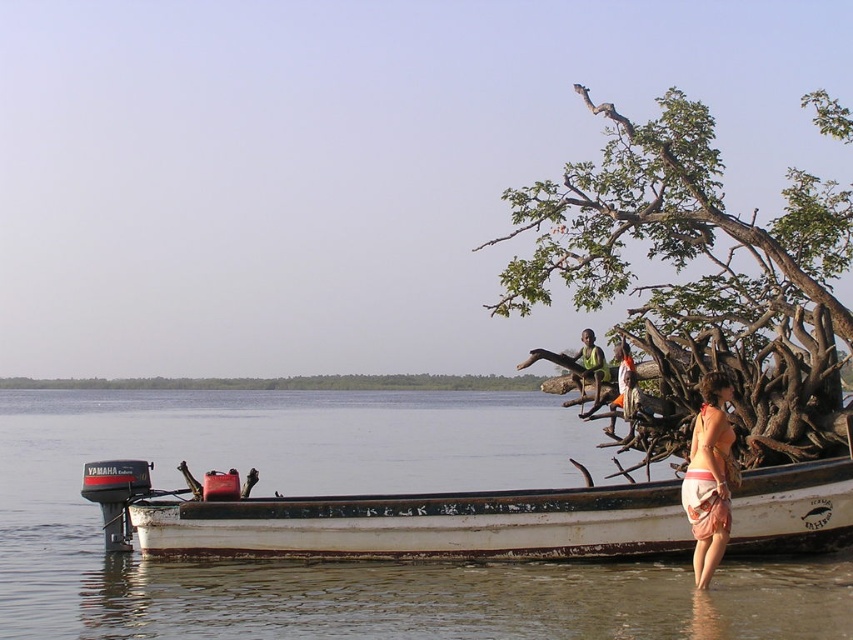
You are standing at the center of the boat and looking towards the green leafy tree at upper right. Based on the coordinates provided, is the tree positioned to your left or right side?

The green leafy tree at upper right is located at point coordinates, so from the center of the boat, the tree is positioned to your right side.

You are standing at the riverside next to the small weathered wooden boat with Yamaha outboard motor at the stern. You want to pick an apple from the green leafy tree at upper right. Can you reach it with a 20 meter long fishing rod?

The green leafy tree at upper right is 24.21 meters away from the viewer. Since the fishing rod is only 20 meters long, you cannot reach it.

You are standing on the riverside and see the green leafy tree at upper right and the green fabric shirt at center. Which object is located higher from the ground?

The green leafy tree at upper right is positioned over the green fabric shirt at center, so it is higher from the ground.